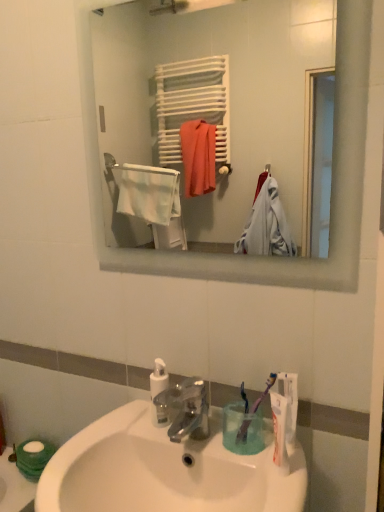
How much space does purple plastic toothbrush at lower center, which is the 1th toothbrush from left to right, occupy horizontally?

purple plastic toothbrush at lower center, which is the 1th toothbrush from left to right, is 1.85 inches in width.

Measure the distance between white matte towel rack at upper center and camera.

The depth of white matte towel rack at upper center is 2.25 meters.

Where is `purple plastic toothbrush at lower center, which ranks as the 2th toothbrush in right-to-left order`? This screenshot has width=384, height=512. purple plastic toothbrush at lower center, which ranks as the 2th toothbrush in right-to-left order is located at coordinates (243, 431).

Is white matte toothpaste at lower right placed right next to white matte towel rack at upper center?

They are not placed beside each other.

Is point (295, 418) closer or farther from the camera than point (270, 244)?

Point (295, 418) is positioned closer to the camera compared to point (270, 244).

Who is bigger, white matte toothpaste at lower right or white matte towel rack at upper center?

Bigger between the two is white matte towel rack at upper center.

From a real-world perspective, which object rests below the other?

white matte toothpaste at lower right is physically lower.

Is white matte towel rack at upper center to the left of white matte toothpaste at lower right from the viewer's perspective?

Indeed, white matte towel rack at upper center is positioned on the left side of white matte toothpaste at lower right.

Who is bigger, white matte towel rack at upper center or white matte toothpaste at lower right?

white matte towel rack at upper center is bigger.

From the image's perspective, who appears lower, white matte towel rack at upper center or white matte toothpaste at lower right?

white matte toothpaste at lower right.

Which is more to the left, purple plastic toothbrush at lower center, which ranks as the 2th toothbrush in right-to-left order, or white glossy sink at lower center?

white glossy sink at lower center is more to the left.

Is purple plastic toothbrush at lower center, which ranks as the 2th toothbrush in right-to-left order, facing away from white glossy sink at lower center?

No, purple plastic toothbrush at lower center, which ranks as the 2th toothbrush in right-to-left order, is not facing away from white glossy sink at lower center.

Is purple plastic toothbrush at lower center, which is the 1th toothbrush from left to right, wider or thinner than white glossy sink at lower center?

Considering their sizes, purple plastic toothbrush at lower center, which is the 1th toothbrush from left to right, looks slimmer than white glossy sink at lower center.

Is white matte toilet paper at lower left surrounded by white matte towel rack at upper center?

No.

Which object is more forward, white matte towel rack at upper center or white matte toilet paper at lower left?

white matte towel rack at upper center is more forward.

Which is more distant, (294, 49) or (28, 460)?

The point (294, 49) is farther.

Which of these two, white matte towel rack at upper center or white matte toilet paper at lower left, stands shorter?

Standing shorter between the two is white matte toilet paper at lower left.

Considering the sizes of objects white matte toothpaste at lower right and white glossy sink at lower center in the image provided, who is smaller, white matte toothpaste at lower right or white glossy sink at lower center?

white matte toothpaste at lower right.

At what (x,y) coordinates should I click in order to perform the action: click on sink that is on the left side of white matte toothpaste at lower right. Please return your answer as a coordinate pair (x, y). Looking at the image, I should click on (166, 470).

From a real-world perspective, is white matte toothpaste at lower right physically located above or below white glossy sink at lower center?

In terms of real-world spatial position, white matte toothpaste at lower right is above white glossy sink at lower center.

Is white matte toothpaste at lower right inside the boundaries of white glossy sink at lower center, or outside?

white matte toothpaste at lower right is outside white glossy sink at lower center.

Can you see purple plastic toothbrush at lower center, which is the 1th toothbrush from left to right, touching satin nickel faucet at center?

There is a gap between purple plastic toothbrush at lower center, which is the 1th toothbrush from left to right, and satin nickel faucet at center.

How different are the orientations of purple plastic toothbrush at lower center, which ranks as the 2th toothbrush in right-to-left order, and satin nickel faucet at center in degrees?

The angular difference between purple plastic toothbrush at lower center, which ranks as the 2th toothbrush in right-to-left order, and satin nickel faucet at center is 8.37e-05 degrees.

From the picture: Does purple plastic toothbrush at lower center, which is the 1th toothbrush from left to right, come behind satin nickel faucet at center?

Yes, it is behind satin nickel faucet at center.

Find the location of a particular element. tap below the purple plastic toothbrush at lower center, which ranks as the 2th toothbrush in right-to-left order (from the image's perspective) is located at coordinates (184, 409).

From the image's perspective, between white matte toothpaste at lower right and white matte toilet paper at lower left, which one is located above?

white matte toothpaste at lower right appears higher in the image.

In order to click on toothpaste located on the right of white matte toilet paper at lower left in this screenshot , I will do `click(289, 405)`.

Can you confirm if white matte toothpaste at lower right is wider than white matte toilet paper at lower left?

No, white matte toothpaste at lower right is not wider than white matte toilet paper at lower left.

Is white matte toilet paper at lower left at the back of white matte toothpaste at lower right?

No, white matte toothpaste at lower right is not facing the opposite direction of white matte toilet paper at lower left.

Identify the location of mirror above the white matte toothpaste at lower right (from a real-world perspective). (209, 121).

The image size is (384, 512). In order to click on mirror above the white matte toothpaste at lower right (from the image's perspective) in this screenshot , I will do coord(209,121).

From the image, which object appears to be farther from white matte toilet paper at lower left, purple plastic toothbrush at lower center, which is the 1th toothbrush from left to right, or purple plastic toothbrush at lower right, positioned as the first toothbrush in right-to-left order?

purple plastic toothbrush at lower right, positioned as the first toothbrush in right-to-left order.

Looking at the image, which one is located closer to white glossy sink at lower center, white matte toothpaste at lower right or purple plastic toothbrush at lower center, which is the 1th toothbrush from left to right?

purple plastic toothbrush at lower center, which is the 1th toothbrush from left to right, lies closer to white glossy sink at lower center than the other object.

Which object lies further to the anchor point white matte toilet paper at lower left, white glossy sink at lower center or purple plastic toothbrush at lower center, which is the 1th toothbrush from left to right?

Among the two, purple plastic toothbrush at lower center, which is the 1th toothbrush from left to right, is located further to white matte toilet paper at lower left.

Estimate the real-world distances between objects in this image. Which object is further from satin nickel faucet at center, purple plastic toothbrush at lower center, which ranks as the 2th toothbrush in right-to-left order, or white glossy sink at lower center?

Among the two, purple plastic toothbrush at lower center, which ranks as the 2th toothbrush in right-to-left order, is located further to satin nickel faucet at center.

Estimate the real-world distances between objects in this image. Which object is further from satin nickel faucet at center, white matte towel rack at upper center or purple plastic toothbrush at lower center, which is the 1th toothbrush from left to right?

white matte towel rack at upper center is further to satin nickel faucet at center.

Considering their positions, is purple plastic toothbrush at lower center, which ranks as the 2th toothbrush in right-to-left order, positioned closer to white glossy sink at lower center than white matte toothpaste at lower right?

Among the two, purple plastic toothbrush at lower center, which ranks as the 2th toothbrush in right-to-left order, is located nearer to white glossy sink at lower center.

When comparing their distances from purple plastic toothbrush at lower center, which ranks as the 2th toothbrush in right-to-left order, does white matte toothpaste at lower right or purple plastic toothbrush at lower right, the second toothbrush when ordered from left to right, seem further?

white matte toothpaste at lower right lies further to purple plastic toothbrush at lower center, which ranks as the 2th toothbrush in right-to-left order, than the other object.

Estimate the real-world distances between objects in this image. Which object is closer to white matte towel rack at upper center, purple plastic toothbrush at lower center, which is the 1th toothbrush from left to right, or satin nickel faucet at center?

satin nickel faucet at center is positioned closer to the anchor white matte towel rack at upper center.

This screenshot has height=512, width=384. In order to click on toothpaste between white matte towel rack at upper center and purple plastic toothbrush at lower right, the second toothbrush when ordered from left to right, from top to bottom in this screenshot , I will do `click(289, 405)`.

Where is `tap between white matte towel rack at upper center and white matte toilet paper at lower left vertically`? The width and height of the screenshot is (384, 512). tap between white matte towel rack at upper center and white matte toilet paper at lower left vertically is located at coordinates (184, 409).

Locate an element on the screen. tap between white matte towel rack at upper center and white glossy sink at lower center in the vertical direction is located at coordinates (184, 409).

At what (x,y) coordinates should I click in order to perform the action: click on toothpaste between white glossy sink at lower center and purple plastic toothbrush at lower center, which ranks as the 2th toothbrush in right-to-left order, from front to back. Please return your answer as a coordinate pair (x, y). This screenshot has width=384, height=512. Looking at the image, I should click on (289, 405).